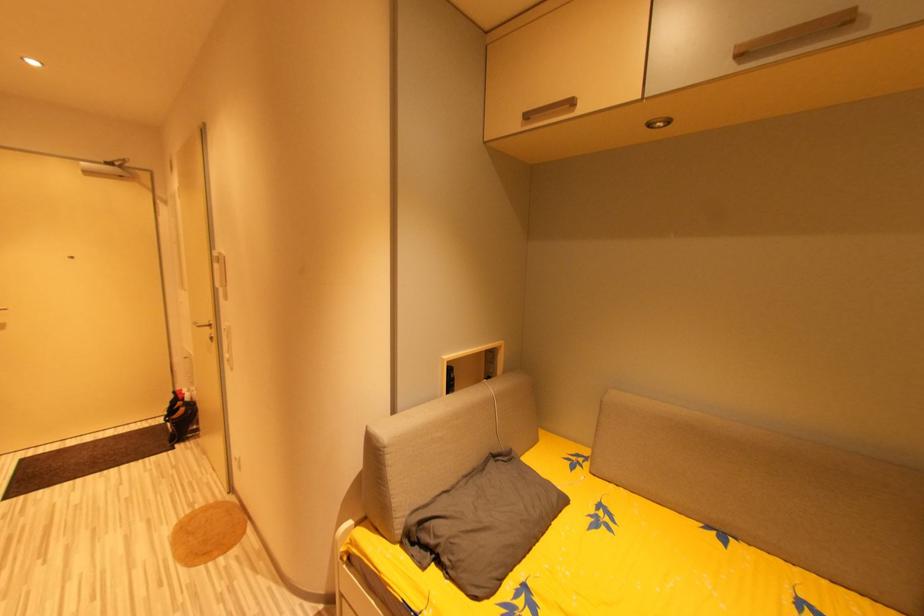
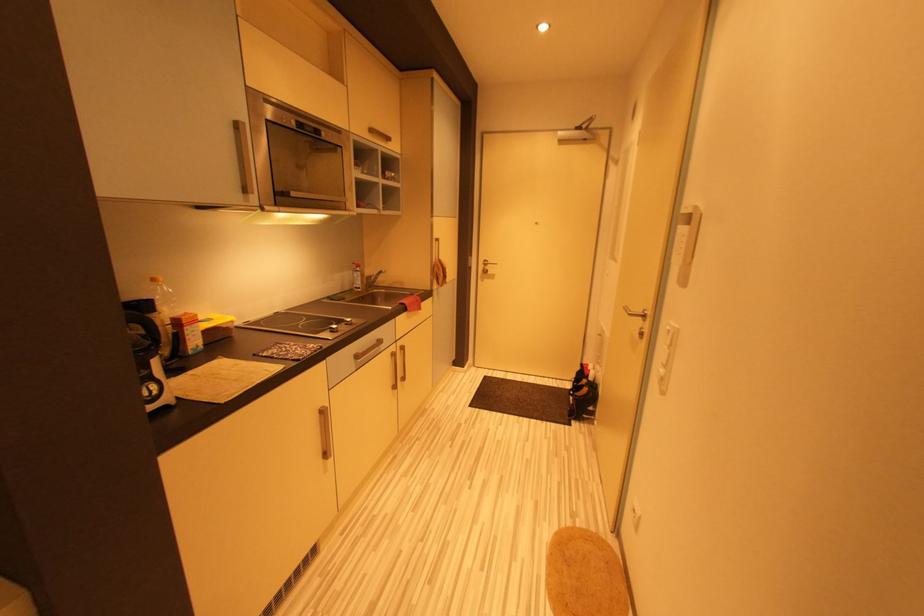
Question: Based on the continuous images, in which direction is the camera rotating? Reply with the corresponding letter.

Choices:
 (A) Left
 (B) Right
 (C) Up
 (D) Down

Answer: (A)